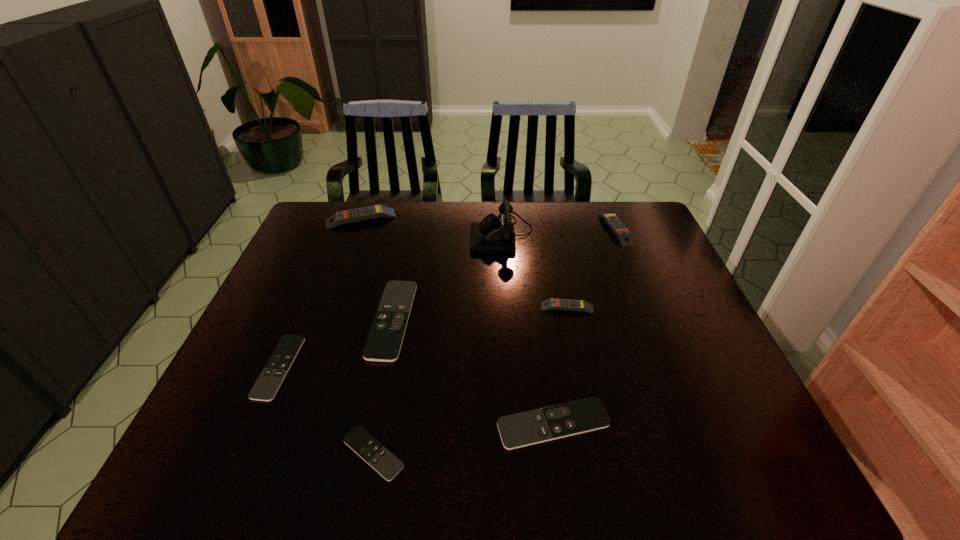
Identify the location of telephone. The height and width of the screenshot is (540, 960). (493, 235).

The image size is (960, 540). I want to click on the tallest remote control, so click(376, 211).

Locate an element on the screen. This screenshot has height=540, width=960. the second tallest object is located at coordinates (376, 211).

You are a GUI agent. You are given a task and a screenshot of the screen. Output one action in this format:
    pyautogui.click(x=<x>, y=<y>)
    Task: Click on the rightmost yellow remote control
    
    Given the screenshot: What is the action you would take?
    pyautogui.click(x=624, y=236)

Where is `the third tallest object`? the third tallest object is located at coordinates (624, 236).

Where is `the third tallest remote control`? The height and width of the screenshot is (540, 960). the third tallest remote control is located at coordinates (553, 303).

Image resolution: width=960 pixels, height=540 pixels. Find the location of `the smallest yellow remote control`. the smallest yellow remote control is located at coordinates (553, 303).

You are a GUI agent. You are given a task and a screenshot of the screen. Output one action in this format:
    pyautogui.click(x=<x>, y=<y>)
    Task: Click on the fourth tallest remote control
    
    Given the screenshot: What is the action you would take?
    pyautogui.click(x=384, y=342)

At what (x,y) coordinates should I click in order to perform the action: click on the fourth shortest object. Please return your answer as a coordinate pair (x, y). Looking at the image, I should click on (384, 342).

The image size is (960, 540). I want to click on the rightmost black remote control, so click(x=518, y=430).